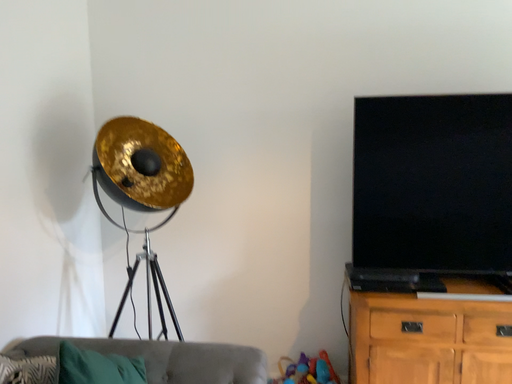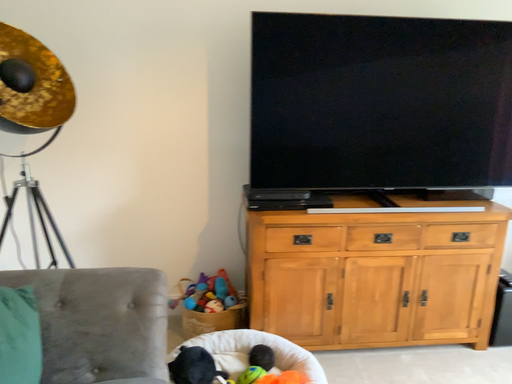
Question: How did the camera likely rotate when shooting the video?

Choices:
 (A) rotated downward
 (B) rotated upward

Answer: (A)